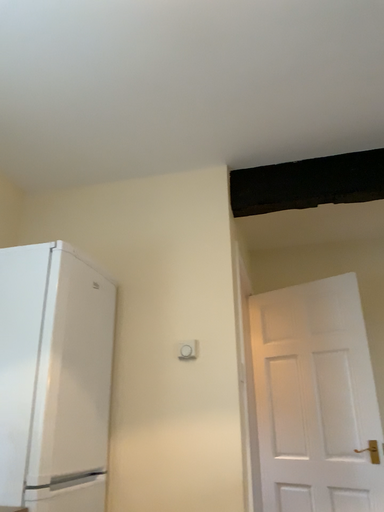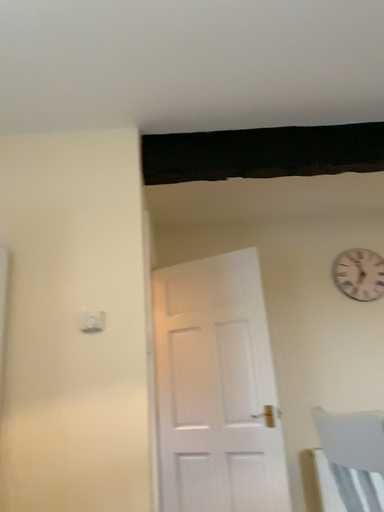
Question: How did the camera likely rotate when shooting the video?

Choices:
 (A) rotated left
 (B) rotated right

Answer: (B)